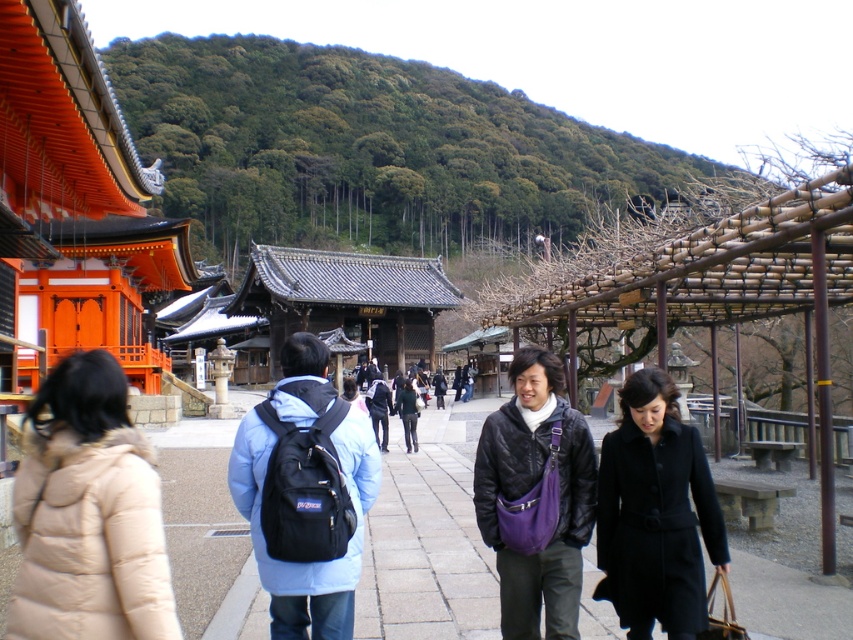
Is beige puffer jacket at lower left further to the viewer compared to black matte coat at center?

No, beige puffer jacket at lower left is in front of black matte coat at center.

Does beige puffer jacket at lower left appear over black matte coat at center?

A: Yes.

Is point (53, 472) closer to camera compared to point (666, 433)?

Yes, point (53, 472) is closer to viewer.

At what (x,y) coordinates should I click in order to perform the action: click on beige puffer jacket at lower left. Please return your answer as a coordinate pair (x, y). The image size is (853, 640). Looking at the image, I should click on (88, 515).

Does point (231, 630) come in front of point (671, 618)?

No, it is behind (671, 618).

Does paved stone walkway at center have a larger size compared to black matte coat at center?

Indeed, paved stone walkway at center has a larger size compared to black matte coat at center.

Between point (593, 580) and point (624, 502), which one is positioned in front?

Point (624, 502)

This screenshot has width=853, height=640. What are the coordinates of `paved stone walkway at center` in the screenshot? It's located at (x=428, y=538).

Is paved stone walkway at center behind beige puffer jacket at lower left?

Yes.

Which of these two, paved stone walkway at center or beige puffer jacket at lower left, stands shorter?

Standing shorter between the two is paved stone walkway at center.

Where is `paved stone walkway at center`? The height and width of the screenshot is (640, 853). paved stone walkway at center is located at coordinates (428, 538).

Where is `paved stone walkway at center`? This screenshot has height=640, width=853. paved stone walkway at center is located at coordinates (428, 538).